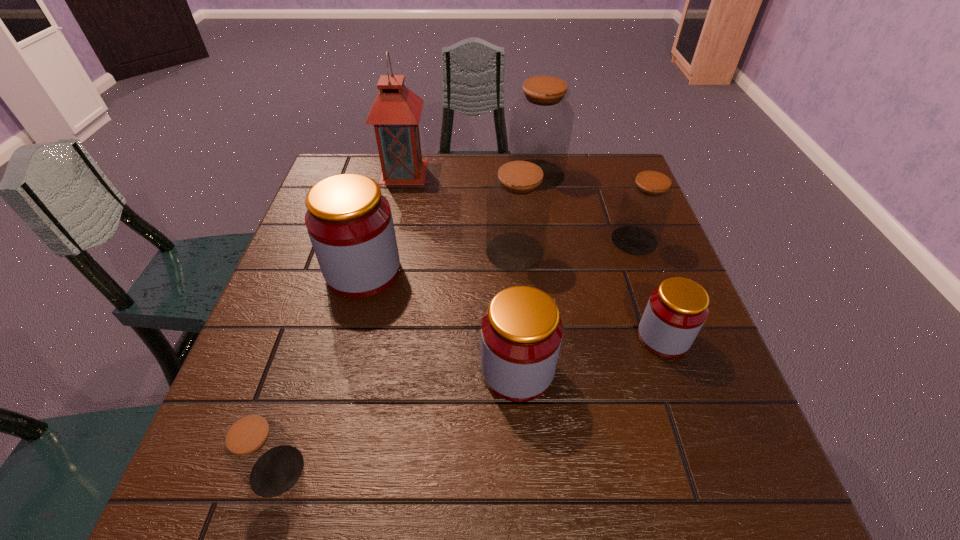
At what (x,y) coordinates should I click in order to perform the action: click on free space at the far right corner of the desktop. Please return your answer as a coordinate pair (x, y). Looking at the image, I should click on (591, 178).

Where is `blank region between the nearest jar and the second red jar from right to left`? The width and height of the screenshot is (960, 540). blank region between the nearest jar and the second red jar from right to left is located at coordinates (397, 421).

Find the location of a particular element. vacant region between the nearest brown jar and the farthest red jar is located at coordinates (321, 371).

In order to click on free space between the farthest brown jar and the nearest brown jar in this screenshot , I will do `click(407, 322)`.

Find the location of `free spot between the rightmost brown jar and the second red jar from left to right`. free spot between the rightmost brown jar and the second red jar from left to right is located at coordinates (576, 305).

At what (x,y) coordinates should I click in order to perform the action: click on free space between the second biggest brown jar and the farthest red jar. Please return your answer as a coordinate pair (x, y). The image size is (960, 540). Looking at the image, I should click on (439, 261).

The height and width of the screenshot is (540, 960). Find the location of `free space between the third smallest brown jar and the biggest red jar`. free space between the third smallest brown jar and the biggest red jar is located at coordinates (439, 261).

The height and width of the screenshot is (540, 960). I want to click on empty space that is in between the nearest jar and the rightmost red jar, so click(470, 404).

Where is `free space that is in between the biggest brown jar and the second biggest red jar`? Image resolution: width=960 pixels, height=540 pixels. free space that is in between the biggest brown jar and the second biggest red jar is located at coordinates (527, 272).

Identify which object is the nearest to the second red jar from right to left. Please provide its 2D coordinates. Your answer should be formatted as a tuple, i.e. [(x, y)], where the tuple contains the x and y coordinates of a point satisfying the conditions above.

[(676, 311)]